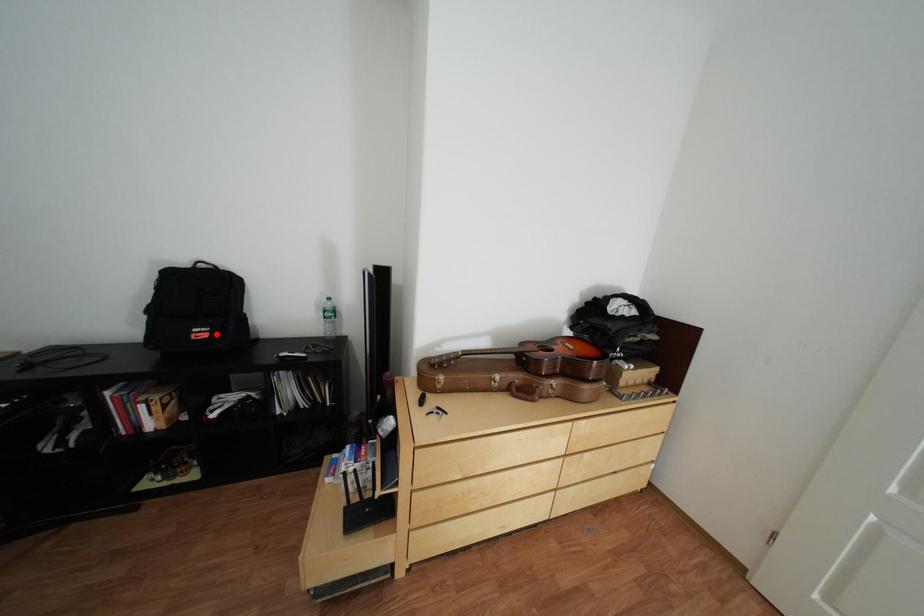
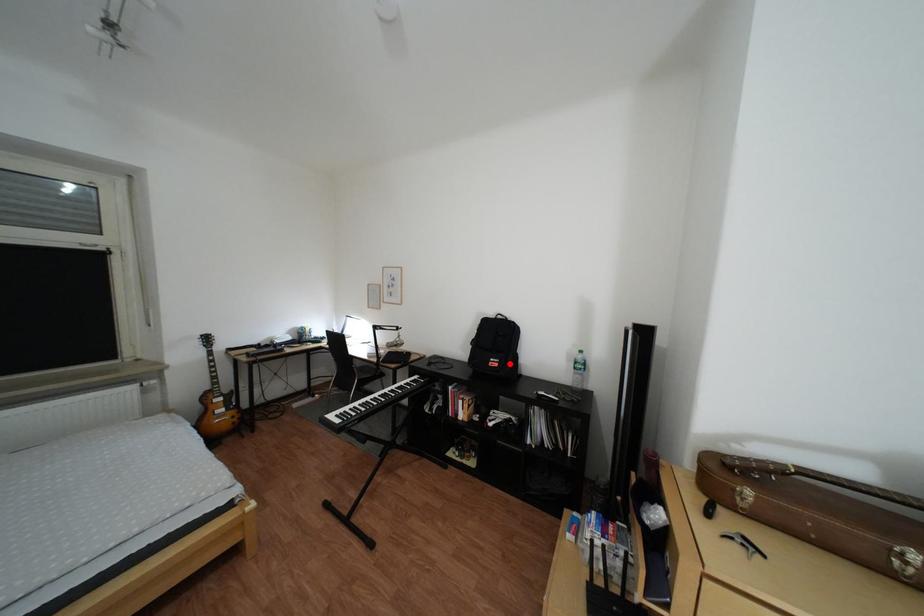
I am providing you with two images of the same scene from different viewpoints. A red point is marked on the first image and another point is marked on the second image. Is the marked point in image1 the same physical position as the marked point in image2?

Yes